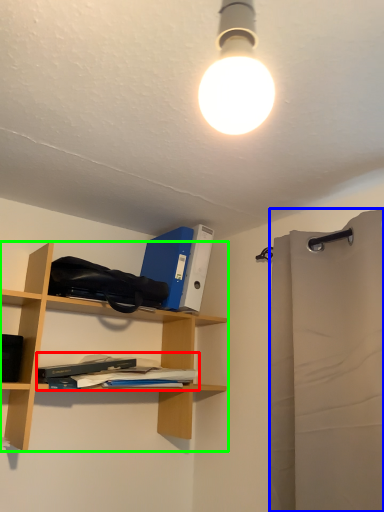
Question: Which object is positioned closest to book (highlighted by a red box)? Select from shower curtain (highlighted by a blue box) and shelf (highlighted by a green box).

Choices:
 (A) shower curtain
 (B) shelf

Answer: (B)